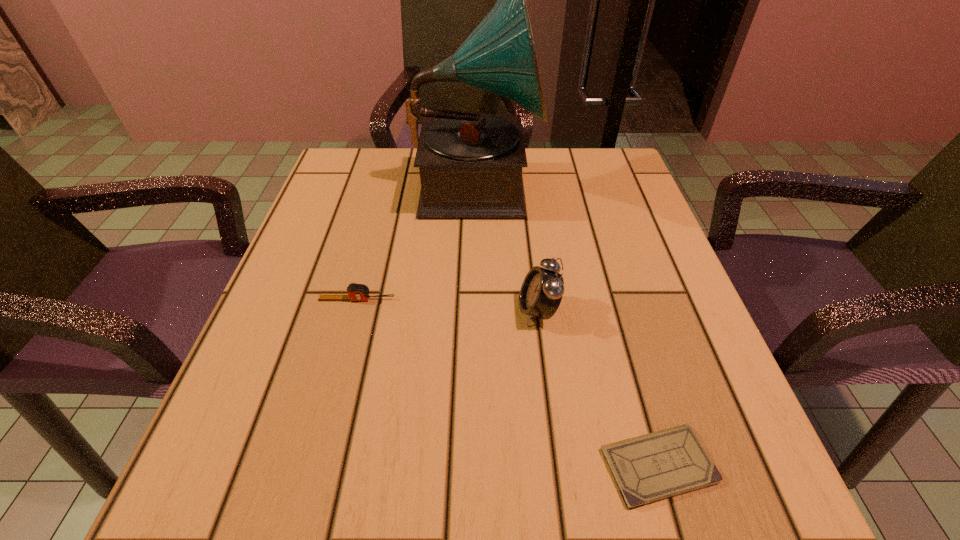
At what (x,y) coordinates should I click in order to perform the action: click on free location that satisfies the following two spatial constraints: 1. on the front side of the shortest object; 2. on the left side of the tape measure. Please return your answer as a coordinate pair (x, y). Looking at the image, I should click on (313, 465).

Locate an element on the screen. free space that satisfies the following two spatial constraints: 1. on the face of the third shortest object; 2. on the left side of the shortest object is located at coordinates pyautogui.click(x=557, y=465).

Locate an element on the screen. The width and height of the screenshot is (960, 540). free region that satisfies the following two spatial constraints: 1. on the face of the second tallest object; 2. on the right side of the nearest object is located at coordinates (557, 465).

I want to click on free space that satisfies the following two spatial constraints: 1. on the horn of the rightmost object; 2. on the left side of the record player, so click(x=473, y=465).